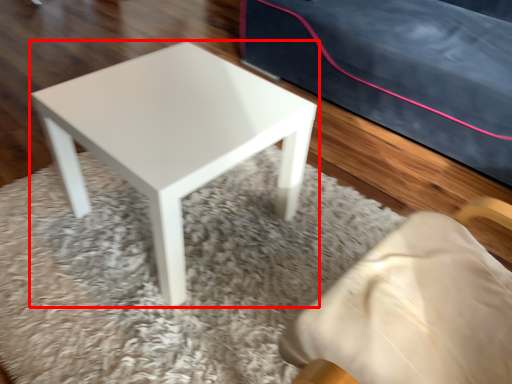
Question: Where is stool (annotated by the red box) located in relation to mat in the image?

Choices:
 (A) left
 (B) right

Answer: (A)